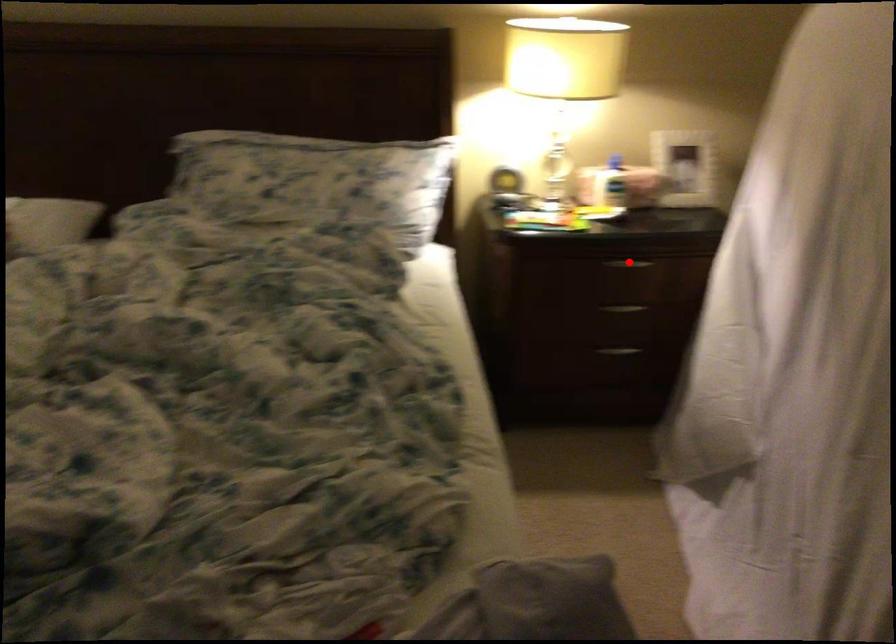
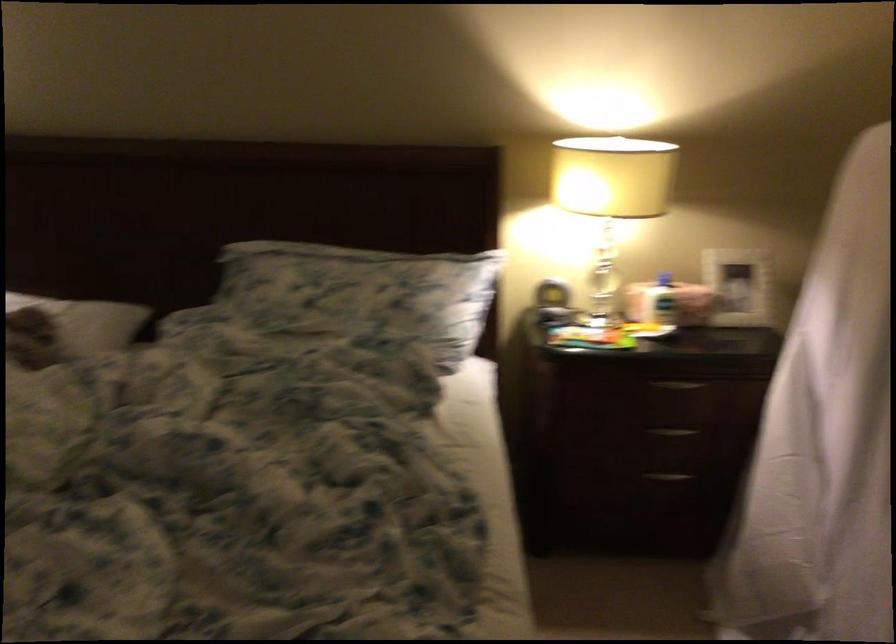
Question: I am providing you with two images of the same scene from different viewpoints. A red point is marked on the first image. Is the red point's position out of view in image 2?

Choices:
 (A) Yes
 (B) No

Answer: (B)